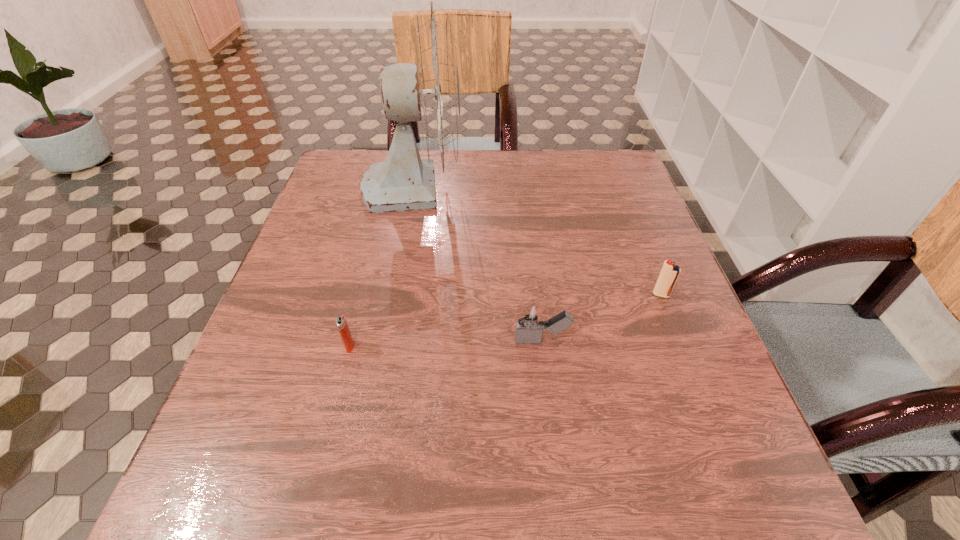
Locate an element on the screen. The image size is (960, 540). free point that satisfies the following two spatial constraints: 1. on the back side of the farthest igniter; 2. on the left side of the second object from right to left is located at coordinates (537, 295).

You are a GUI agent. You are given a task and a screenshot of the screen. Output one action in this format:
    pyautogui.click(x=<x>, y=<y>)
    Task: Click on the free space that satisfies the following two spatial constraints: 1. on the back side of the second igniter from right to left; 2. in front of the fan to blow air
    The width and height of the screenshot is (960, 540).
    Given the screenshot: What is the action you would take?
    pyautogui.click(x=523, y=186)